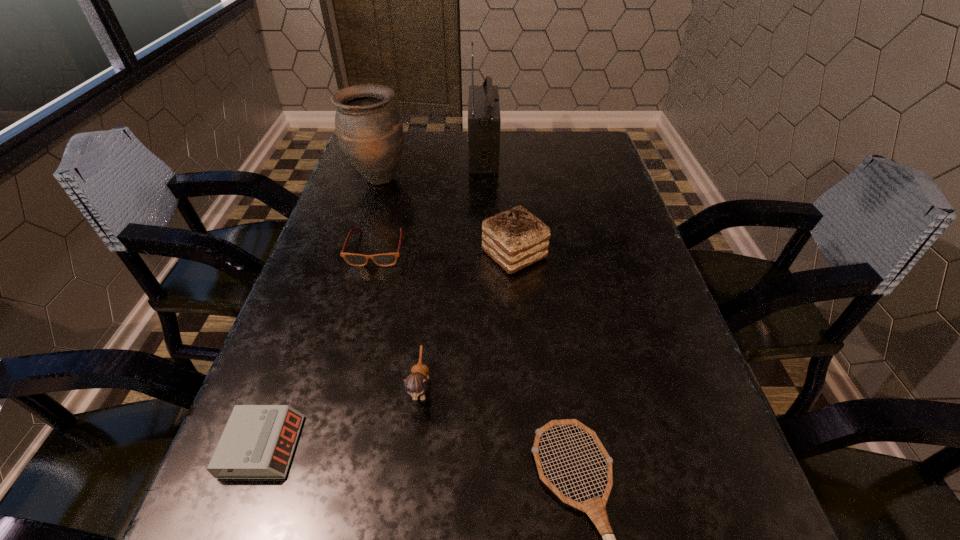
Where is `free space between the alarm clock and the spectacles`? free space between the alarm clock and the spectacles is located at coordinates tap(320, 348).

Locate an element on the screen. The height and width of the screenshot is (540, 960). vacant space that is in between the fourth object from right to left and the alarm clock is located at coordinates (342, 416).

Image resolution: width=960 pixels, height=540 pixels. What are the coordinates of `object that is the sixth closest one to the alarm clock` in the screenshot? It's located at (484, 120).

What are the coordinates of `the third closest object to the fifth shortest object` in the screenshot? It's located at (369, 129).

At what (x,y) coordinates should I click in order to perform the action: click on free space that satisfies the following two spatial constraints: 1. on the back side of the second tallest object; 2. on the left side of the alarm clock. Please return your answer as a coordinate pair (x, y). Looking at the image, I should click on (361, 179).

Where is `free space in the image that satisfies the following two spatial constraints: 1. on the front-facing side of the chocolate cake; 2. on the right side of the spectacles`? This screenshot has height=540, width=960. free space in the image that satisfies the following two spatial constraints: 1. on the front-facing side of the chocolate cake; 2. on the right side of the spectacles is located at coordinates (375, 254).

What are the coordinates of `vacant space that satisfies the following two spatial constraints: 1. on the front panel of the chocolate cake; 2. on the left side of the tallest object` in the screenshot? It's located at (484, 254).

Find the location of a particular element. vacant area in the image that satisfies the following two spatial constraints: 1. on the front-facing side of the chocolate cake; 2. on the right side of the spectacles is located at coordinates (375, 254).